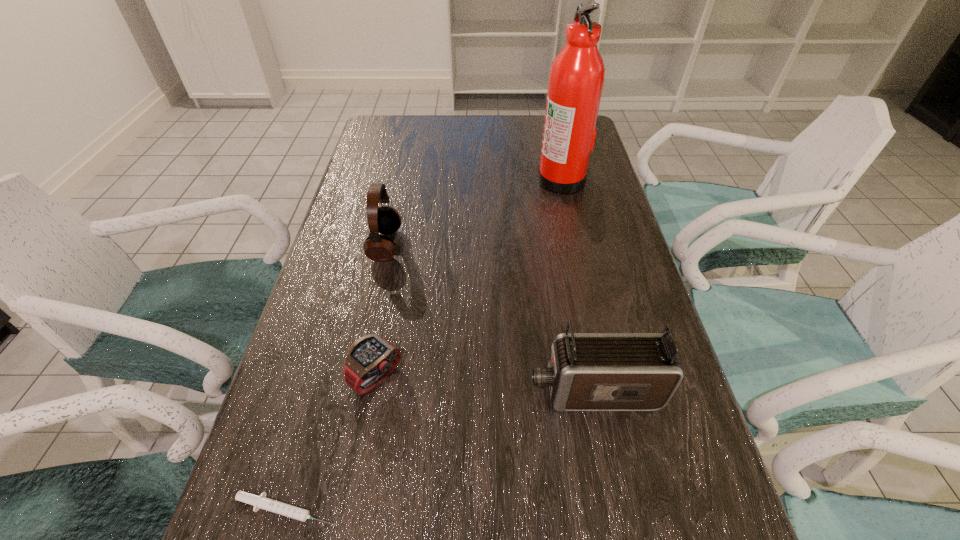
Where is `fire extinguisher`? This screenshot has width=960, height=540. fire extinguisher is located at coordinates (576, 79).

The height and width of the screenshot is (540, 960). In order to click on the farthest object in this screenshot , I will do `click(576, 79)`.

Image resolution: width=960 pixels, height=540 pixels. Find the location of `camcorder`. camcorder is located at coordinates [586, 371].

Where is `the fourth nearest object`? This screenshot has height=540, width=960. the fourth nearest object is located at coordinates (386, 220).

The width and height of the screenshot is (960, 540). Identify the location of watch. coord(370,359).

At what (x,y) coordinates should I click in order to perform the action: click on the shortest object. Please return your answer as a coordinate pair (x, y). This screenshot has height=540, width=960. Looking at the image, I should click on (259, 502).

Locate an element on the screen. This screenshot has height=540, width=960. the nearest object is located at coordinates (259, 502).

The height and width of the screenshot is (540, 960). Identify the location of vacant area situated 0.270m on the label side of the fire extinguisher. (446, 179).

Where is `free space located 0.200m on the label side of the fire extinguisher`? free space located 0.200m on the label side of the fire extinguisher is located at coordinates (469, 179).

Identify the location of vacant space located on the label side of the fire extinguisher. The height and width of the screenshot is (540, 960). (423, 179).